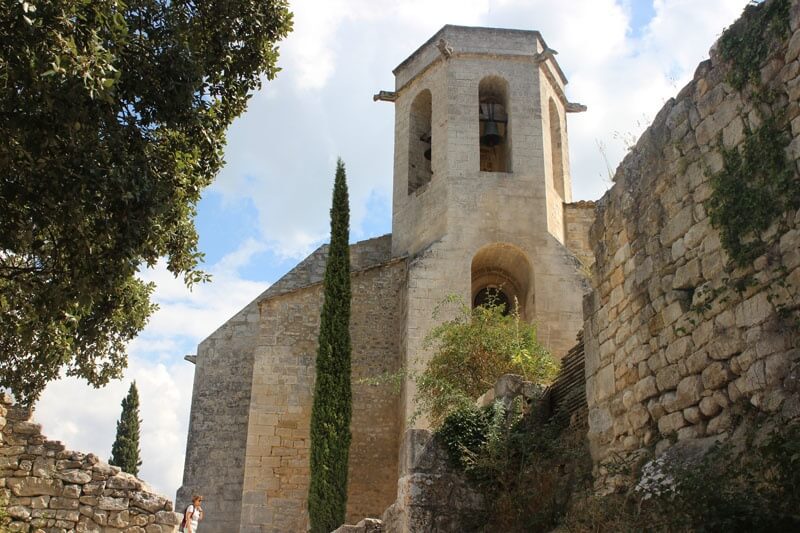
The image size is (800, 533). Find the location of `stairs`. stairs is located at coordinates (354, 526).